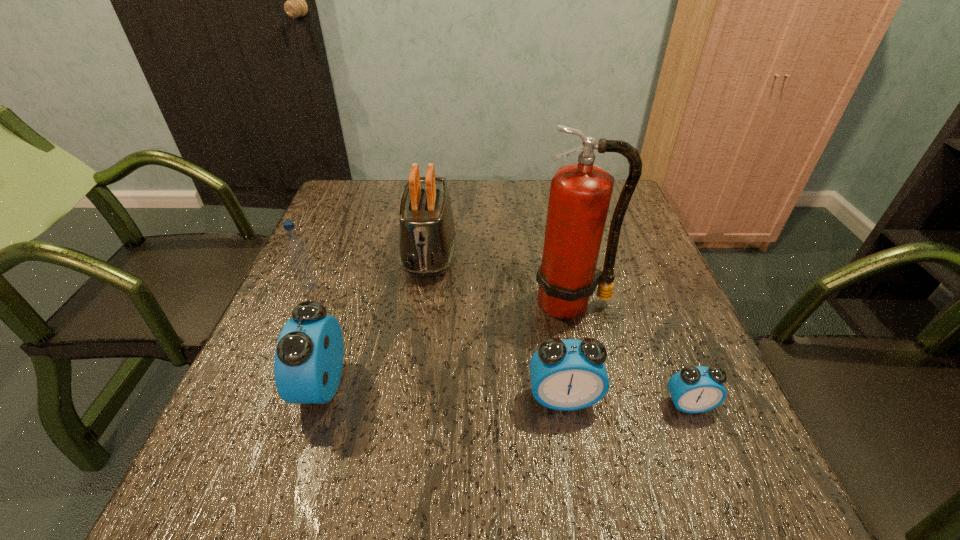
I want to click on object present at the near right corner, so click(698, 389).

This screenshot has width=960, height=540. Find the location of `free point at the far edge`. free point at the far edge is located at coordinates (524, 220).

This screenshot has height=540, width=960. I want to click on vacant region at the left edge of the desktop, so click(366, 226).

I want to click on blank space at the right edge of the desktop, so click(x=668, y=305).

Where is `vacant space at the far left corner of the desktop`? The image size is (960, 540). vacant space at the far left corner of the desktop is located at coordinates (380, 187).

Where is `vacant area at the near left corner`? The width and height of the screenshot is (960, 540). vacant area at the near left corner is located at coordinates (262, 418).

At what (x,y) coordinates should I click in order to perform the action: click on free area in between the leftmost object and the second shortest alarm clock. Please return your answer as a coordinate pair (x, y). This screenshot has height=540, width=960. Looking at the image, I should click on (437, 343).

You are a GUI agent. You are given a task and a screenshot of the screen. Output one action in this format:
    pyautogui.click(x=<x>, y=<y>)
    Task: Click on the free space that is in between the fifth object from right to left and the second shortest object
    
    Given the screenshot: What is the action you would take?
    pyautogui.click(x=443, y=392)

Identify the location of vacant space in between the fifth shortest object and the leftmost alarm clock. pos(376,319).

Locate an element on the screen. This screenshot has height=540, width=960. free spot between the fire extinguisher and the third object from left to right is located at coordinates (500, 278).